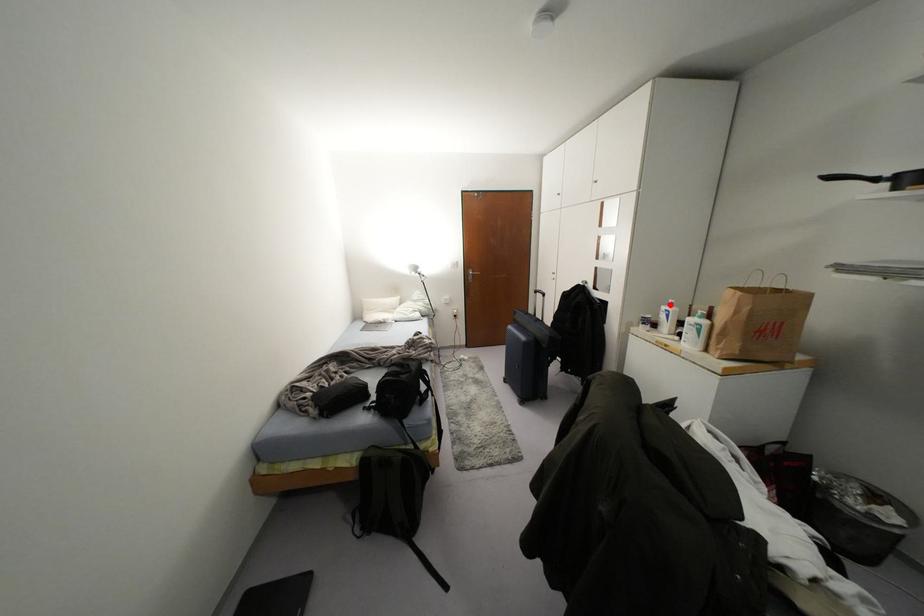
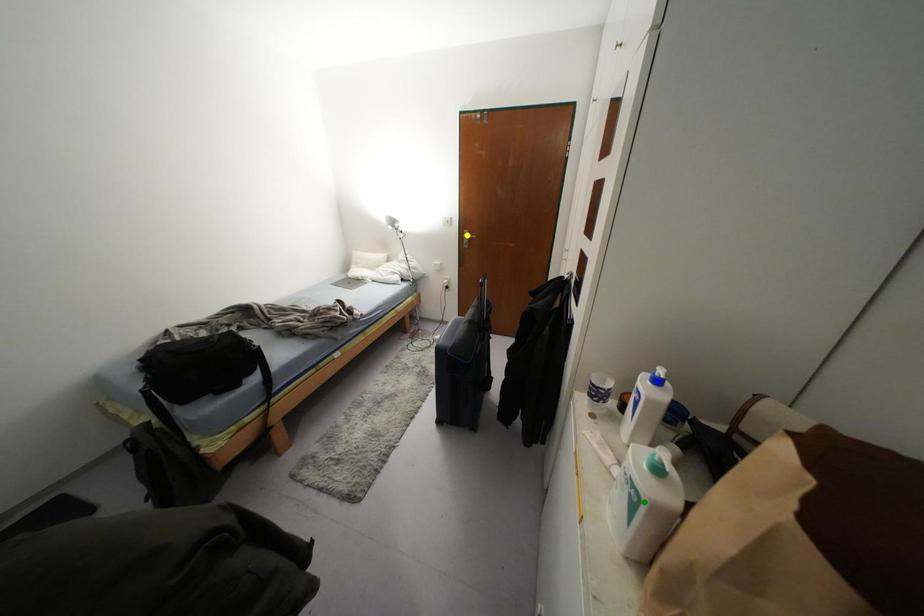
Question: I am providing you with two images of the same scene from different viewpoints. A red point is marked on the first image. You are given multiple points on the second image. Which mark in image 2 goes with the point in image 1?

Choices:
 (A) yellow point
 (B) blue point
 (C) green point

Answer: (B)